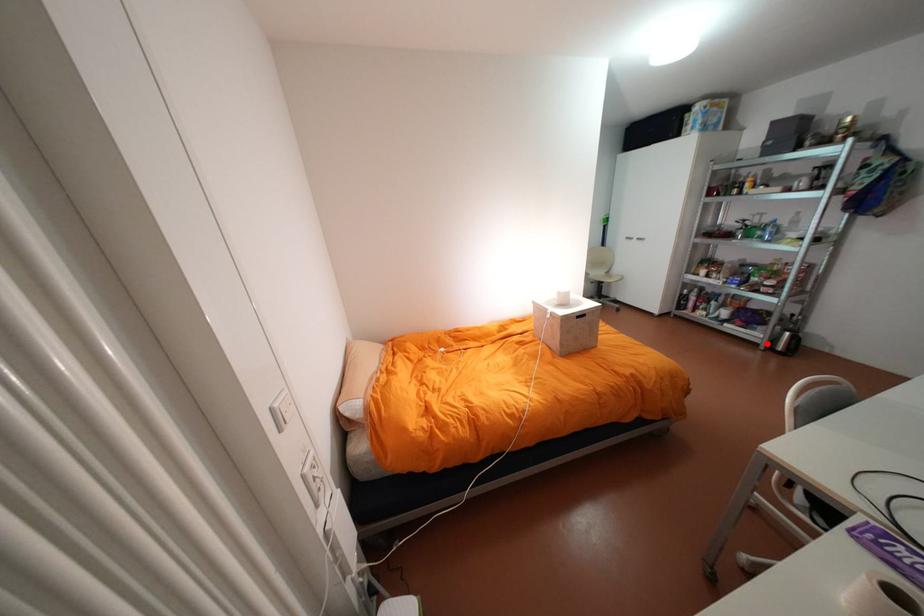
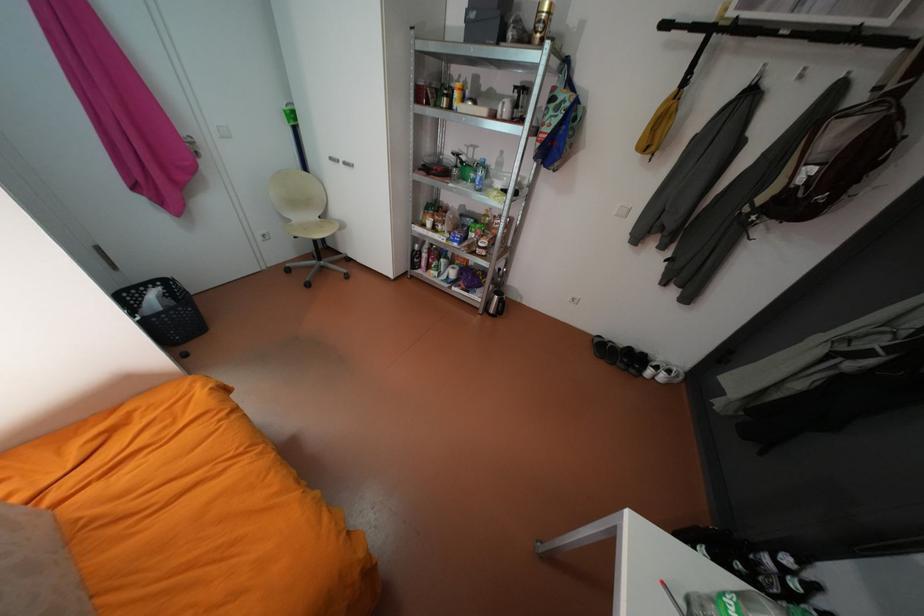
The point at the highlighted location is marked in the first image. Where is the corresponding point in the second image?

(487, 308)